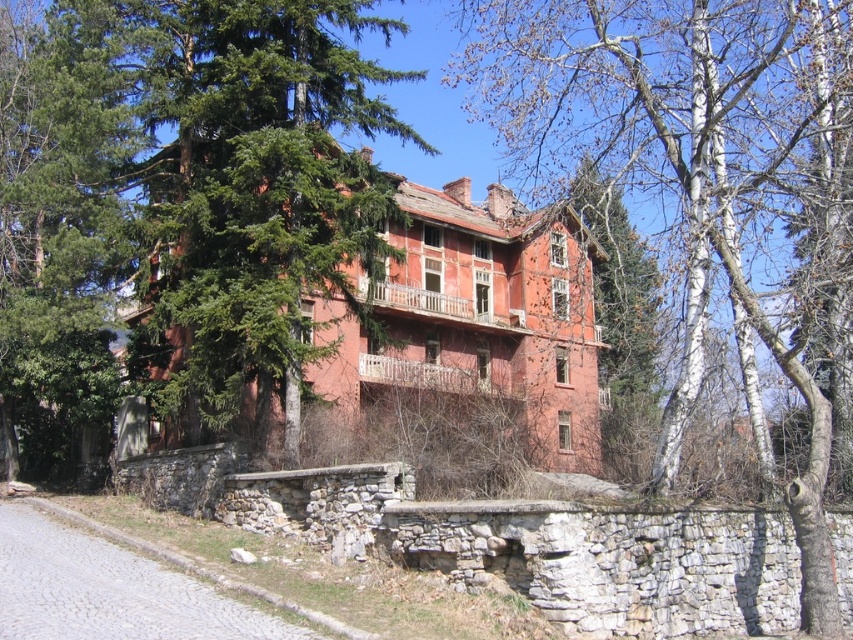
Question: Is bare birch tree at upper right above green coniferous tree at upper left?

Choices:
 (A) no
 (B) yes

Answer: (B)

Question: Which point is farther from the camera taking this photo?

Choices:
 (A) (177, 51)
 (B) (828, 99)

Answer: (A)

Question: Which of the following is the closest to the observer?

Choices:
 (A) green coniferous tree at upper left
 (B) bare birch tree at upper right

Answer: (B)

Question: From the image, what is the correct spatial relationship of bare birch tree at upper right in relation to green coniferous tree at upper left?

Choices:
 (A) below
 (B) above

Answer: (B)

Question: Can you confirm if bare birch tree at upper right is smaller than green coniferous tree at upper left?

Choices:
 (A) yes
 (B) no

Answer: (B)